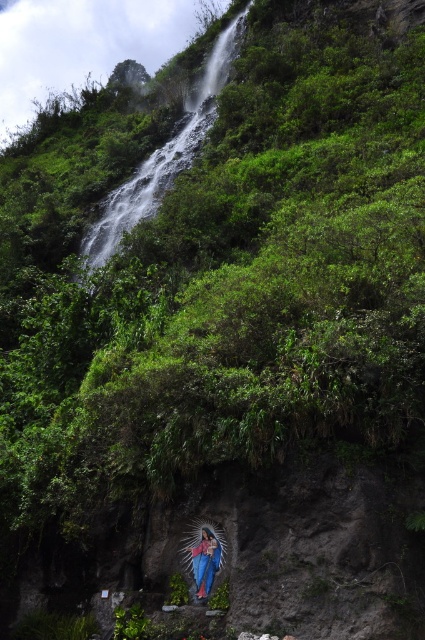
You are a photographer planning to take a photo of the smooth blue statue at lower center and the green leafy waterfall at upper left. Based on their positions, which object should you focus on first if you want to capture both in a single frame without moving the camera?

The smooth blue statue at lower center should be focused on first because it is closer to the camera than the green leafy waterfall at upper left, which is positioned above it.

You are standing at the camera position and want to take a photo of the green leafy waterfall at upper left. If your camera has a maximum focus range of 25 meters, will you be able to capture the waterfall clearly?

The green leafy waterfall at upper left and camera are 27.90 meters apart from each other, so the camera cannot focus on the waterfall as it exceeds the maximum focus range of 25 meters.

You are standing at the base of the waterfall on the hillside and want to reach the statue of the Virgin Mary in the rock niche. You see two points marked on your map. One is point (243, 13) and the other is point (193, 547). Which point is closer to you?

Point (243, 13) is closer to you because it is further to the viewer than point (193, 547).